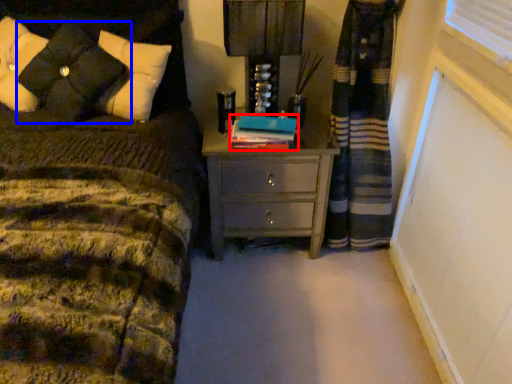
Question: Among these objects, which one is farthest to the camera, book (highlighted by a red box) or pillow (highlighted by a blue box)?

Choices:
 (A) book
 (B) pillow

Answer: (A)